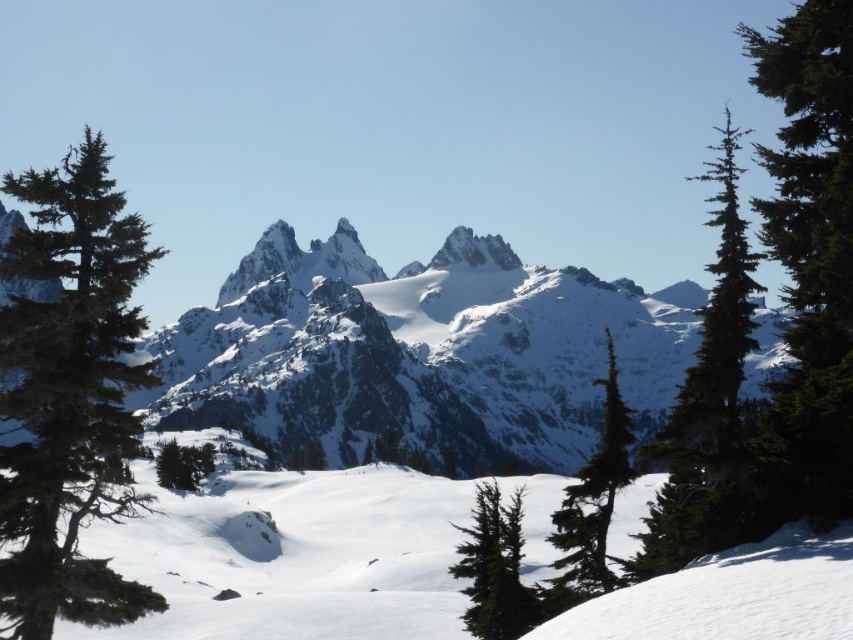
Between green needle-like tree at right and green matte tree at lower right, which one appears on the right side from the viewer's perspective?

green needle-like tree at right

Between green needle-like tree at right and green matte tree at lower right, which one has less height?

green matte tree at lower right

Is point (631, 579) positioned in front of point (564, 548)?

Yes, point (631, 579) is in front of point (564, 548).

Locate an element on the screen. This screenshot has height=640, width=853. green needle-like tree at right is located at coordinates click(708, 404).

Measure the distance between snowy granite mountain range at center and camera.

snowy granite mountain range at center and camera are 152.78 meters apart.

Measure the distance from snowy granite mountain range at center to green textured pine tree at right.

snowy granite mountain range at center is 71.62 meters from green textured pine tree at right.

Is point (271, 420) in front of point (769, 205)?

No.

Find the location of a particular element. The height and width of the screenshot is (640, 853). snowy granite mountain range at center is located at coordinates (419, 355).

Is point (55, 300) closer to viewer compared to point (838, 52)?

No, (55, 300) is further to viewer.

Does green needle-like tree at left lie behind green textured pine tree at right?

No, green needle-like tree at left is closer to the viewer.

Describe the element at coordinates (70, 394) in the screenshot. Image resolution: width=853 pixels, height=640 pixels. I see `green needle-like tree at left` at that location.

Image resolution: width=853 pixels, height=640 pixels. Find the location of `green needle-like tree at left`. green needle-like tree at left is located at coordinates (70, 394).